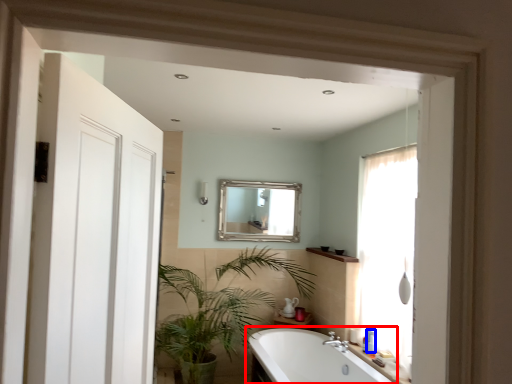
Question: Which of the following is the closest to the observer, bathtub (highlighted by a red box) or toiletry (highlighted by a blue box)?

Choices:
 (A) bathtub
 (B) toiletry

Answer: (A)